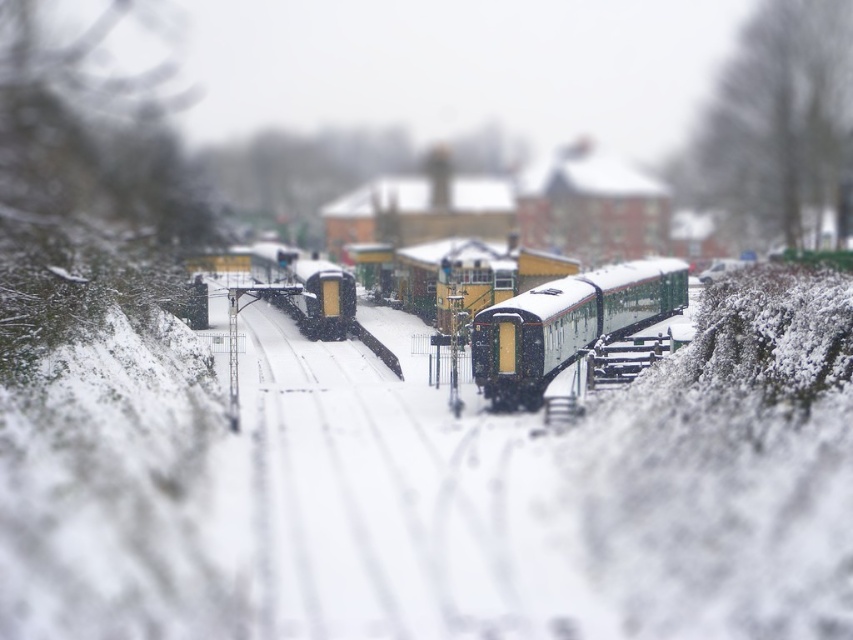
Looking at this image, can you confirm if green matte train at center is smaller than yellow matte train at center?

Actually, green matte train at center might be larger than yellow matte train at center.

Find the location of a particular element. green matte train at center is located at coordinates (567, 324).